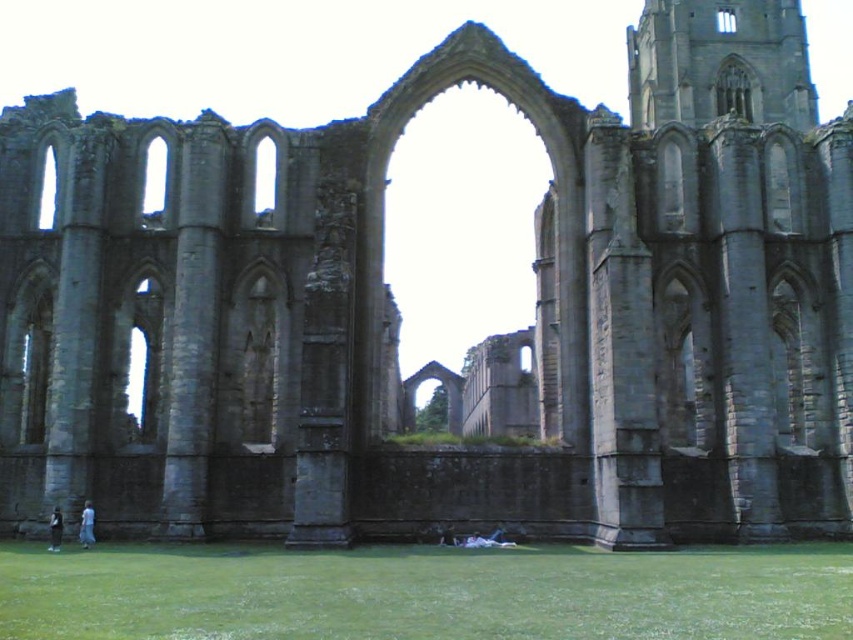
You are standing at the center of the ruins and want to place a small decorative stone exactly at the green grass at lower center. According to the coordinates given, where should you place it?

The green grass at lower center is located at coordinates point (425, 593), so you should place the small decorative stone there.

You are standing at the base of the Gothic ruins and want to take a photo of the blue fabric dress at lower left while avoiding the green grass at lower center in the foreground. Which direction should you move to ensure the dress is visible without the grass obstructing it?

The green grass at lower center is located below the blue fabric dress at lower left. To avoid the grass obstruction, move to the left or right so that the dress is framed above the grass area.

Based on the photo, you are standing at the base of the Gothic ruins and want to sit down. You see the green grass at lower center and the dark gray fabric jacket at lower left. Which one would be a suitable surface to sit on?

The green grass at lower center is larger in size than the dark gray fabric jacket at lower left, so it would be a more suitable surface to sit on as it provides a larger and more stable area.